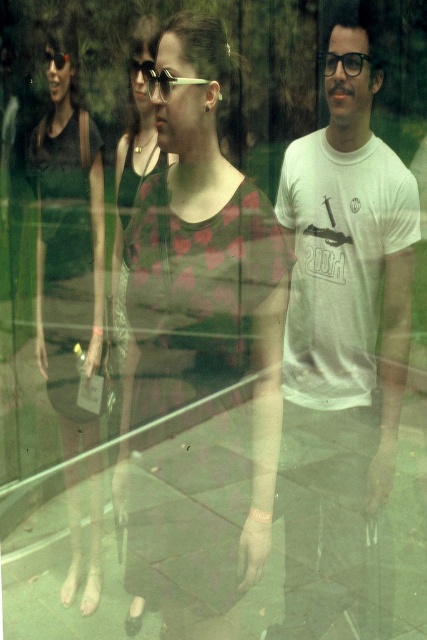
Between matte black dress at left and matte black sunglasses at center, which one is positioned higher?

Positioned higher is matte black sunglasses at center.

Who is taller, matte black dress at left or matte black sunglasses at center?

matte black dress at left

Between point (63, 330) and point (155, 83), which one is positioned in front?

Positioned in front is point (155, 83).

Find the location of a particular element. matte black dress at left is located at coordinates click(69, 248).

Does point (140, 602) lie in front of point (169, 90)?

No, it is behind (169, 90).

Which of these two, matte floral dress at center or matte black sunglasses at center, stands shorter?

Standing shorter between the two is matte black sunglasses at center.

This screenshot has height=640, width=427. What do you see at coordinates (198, 353) in the screenshot? I see `matte floral dress at center` at bounding box center [198, 353].

The height and width of the screenshot is (640, 427). Identify the location of matte floral dress at center. (198, 353).

Who is lower down, white cotton t-shirt at center or matte black dress at left?

white cotton t-shirt at center is lower down.

Which is above, white cotton t-shirt at center or matte black dress at left?

matte black dress at left

What do you see at coordinates (342, 346) in the screenshot? I see `white cotton t-shirt at center` at bounding box center [342, 346].

Find the location of a particular element. The image size is (427, 640). white cotton t-shirt at center is located at coordinates (342, 346).